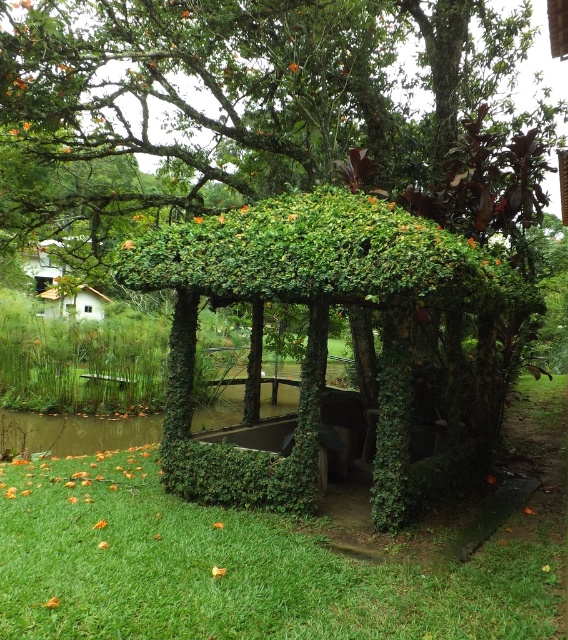
Between point (469, 624) and point (327, 214), which one is positioned in front?

Point (469, 624) is more forward.

Where is `green grass at lower left`? green grass at lower left is located at coordinates (231, 568).

Image resolution: width=568 pixels, height=640 pixels. In order to click on green grass at lower left in this screenshot , I will do `click(231, 568)`.